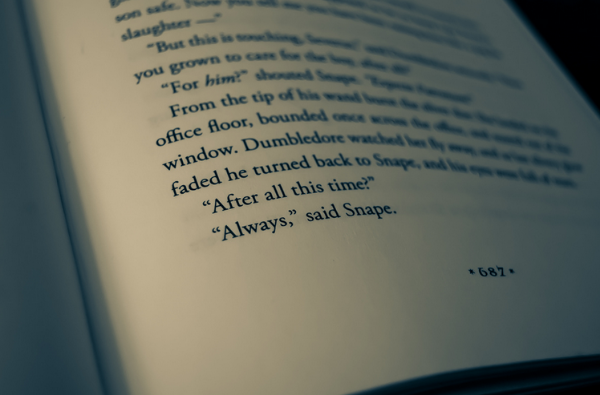
Image resolution: width=600 pixels, height=395 pixels. In order to click on book spine in this screenshot , I will do `click(66, 215)`.